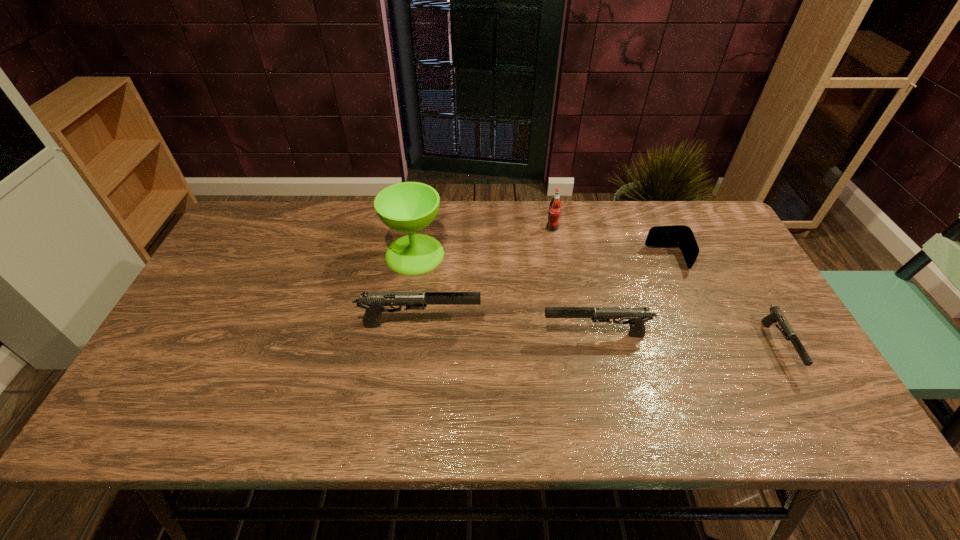
Please point a vacant point for placing a gun on the left. Please provide its 2D coordinates. Your answer should be formatted as a tuple, i.e. [(x, y)], where the tuple contains the x and y coordinates of a point satisfying the conditions above.

[(252, 314)]